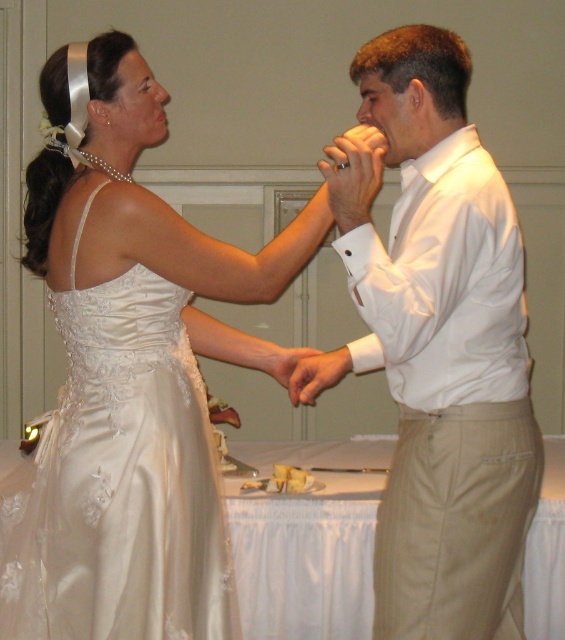
You are a photographer at the wedding reception and need to position your camera to capture the satin dress at center. According to the coordinates given, where should you aim your camera?

The satin dress at center is located at coordinates point (131,371), so you should aim your camera at that position to capture it.